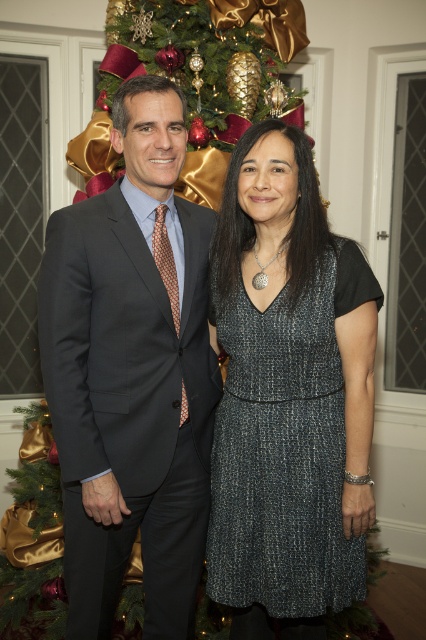
Which is more to the left, dark gray suit at center or sparkly metallic dress at center?

dark gray suit at center

Who is lower down, dark gray suit at center or sparkly metallic dress at center?

Positioned lower is sparkly metallic dress at center.

Which is behind, point (101, 508) or point (336, 413)?

Positioned behind is point (336, 413).

Identify the location of dark gray suit at center. (x=132, y=374).